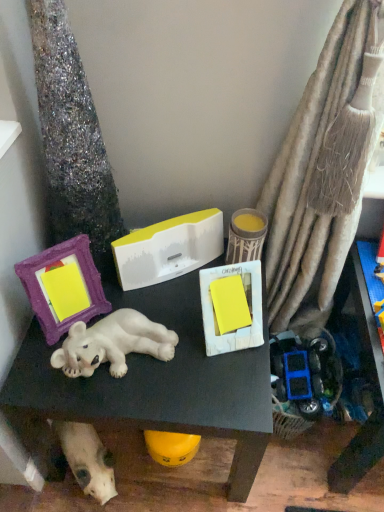
Identify the location of purple fabric picture frame at left. The width and height of the screenshot is (384, 512). (63, 286).

Identify the location of white matte dog at lower left. (87, 459).

What do you see at coordinates (153, 383) in the screenshot? I see `white glossy polar bear at center` at bounding box center [153, 383].

What do you see at coordinates (71, 135) in the screenshot? I see `sparkly silver tree trunk at left` at bounding box center [71, 135].

This screenshot has height=512, width=384. What do you see at coordinates (246, 236) in the screenshot? I see `matte yellow candle at center` at bounding box center [246, 236].

This screenshot has width=384, height=512. Find the location of `purple fabric picture frame at left`. purple fabric picture frame at left is located at coordinates (63, 286).

This screenshot has width=384, height=512. I want to click on toy on the right of white glossy polar bear at center, so click(x=246, y=236).

Which object is more forward, matte yellow candle at center or white glossy polar bear at center?

Positioned in front is white glossy polar bear at center.

Is matte yellow candle at center wider or thinner than white glossy polar bear at center?

matte yellow candle at center is thinner than white glossy polar bear at center.

From a real-world perspective, relative to sparkly silver tree trunk at left, is matte yellow candle at center vertically above or below?

matte yellow candle at center is below sparkly silver tree trunk at left.

Find the location of a particular element. This screenshot has width=384, height=512. toy below the sparkly silver tree trunk at left (from a real-world perspective) is located at coordinates (246, 236).

Would you say sparkly silver tree trunk at left is part of matte yellow candle at center's contents?

That's incorrect, sparkly silver tree trunk at left is not inside matte yellow candle at center.

Looking at this image, is sparkly silver tree trunk at left in front of or behind matte yellow candle at center in the image?

sparkly silver tree trunk at left is positioned closer to the viewer than matte yellow candle at center.

Is the surface of sparkly silver tree trunk at left in direct contact with matte yellow candle at center?

No, sparkly silver tree trunk at left is not next to matte yellow candle at center.

Is sparkly silver tree trunk at left smaller than matte yellow candle at center?

Actually, sparkly silver tree trunk at left might be larger than matte yellow candle at center.

You are a GUI agent. You are given a task and a screenshot of the screen. Output one action in this format:
    pyautogui.click(x=<x>, y=<y>)
    Task: Click on the toy below the sparkly silver tree trunk at left (from the image's perspective)
    
    Given the screenshot: What is the action you would take?
    pyautogui.click(x=246, y=236)

From the image's perspective, is white glossy polar bear at center above or below purple fabric picture frame at left?

Clearly, from the image's perspective, white glossy polar bear at center is below purple fabric picture frame at left.

Which point is more forward, (231, 478) or (59, 253)?

The point (59, 253) is closer.

Does white glossy polar bear at center lie in front of purple fabric picture frame at left?

No, it is not.

Find the location of a particular element. The width and height of the screenshot is (384, 512). table behind the purple fabric picture frame at left is located at coordinates (153, 383).

Looking at this image, does white matte dog at lower left turn towards matte yellow candle at center?

No, white matte dog at lower left is not turned towards matte yellow candle at center.

From a real-world perspective, which object stands above the other?

From a 3D spatial view, matte yellow candle at center is above.

Is white matte dog at lower left far away from matte yellow candle at center?

That's not correct — white matte dog at lower left is a little close to matte yellow candle at center.

Is white glossy polar bear at center facing towards white matte dog at lower left?

Yes.

Can we say white glossy polar bear at center lies outside white matte dog at lower left?

white glossy polar bear at center lies outside white matte dog at lower left's area.

How far apart are white glossy polar bear at center and white matte dog at lower left?

The distance of white glossy polar bear at center from white matte dog at lower left is 10.56 inches.

Between point (90, 410) and point (83, 438), which one is positioned behind?

The point (83, 438) is farther from the camera.

Is point (166, 384) behind point (49, 78)?

Yes, point (166, 384) is farther from viewer.

Is white glossy polar bear at center beside sparkly silver tree trunk at left?

No, white glossy polar bear at center is not touching sparkly silver tree trunk at left.

In terms of height, does white glossy polar bear at center look taller or shorter compared to sparkly silver tree trunk at left?

white glossy polar bear at center is shorter than sparkly silver tree trunk at left.

Considering the relative sizes of white glossy polar bear at center and sparkly silver tree trunk at left in the image provided, is white glossy polar bear at center bigger than sparkly silver tree trunk at left?

Yes.

Where is `toy located on the right of white glossy polar bear at center`? The width and height of the screenshot is (384, 512). toy located on the right of white glossy polar bear at center is located at coordinates (246, 236).

The height and width of the screenshot is (512, 384). I want to click on tree trunk that is above the matte yellow candle at center (from the image's perspective), so click(x=71, y=135).

Looking at the image, which one is located further to sparkly silver tree trunk at left, purple fabric picture frame at left or matte yellow candle at center?

matte yellow candle at center lies further to sparkly silver tree trunk at left than the other object.

Looking at the image, which one is located closer to matte yellow candle at center, purple fabric picture frame at left or white glossy polar bear at center?

white glossy polar bear at center lies closer to matte yellow candle at center than the other object.

When comparing their distances from white glossy polar bear at center, does white matte dog at lower left or matte yellow candle at center seem further?

Among the two, matte yellow candle at center is located further to white glossy polar bear at center.

Which object lies nearer to the anchor point matte yellow candle at center, white matte dog at lower left or purple fabric picture frame at left?

purple fabric picture frame at left is positioned closer to the anchor matte yellow candle at center.

Looking at the image, which one is located further to white glossy polar bear at center, matte yellow candle at center or sparkly silver tree trunk at left?

matte yellow candle at center is positioned further to the anchor white glossy polar bear at center.

Based on the photo, which object lies further to the anchor point white matte dog at lower left, white glossy polar bear at center or sparkly silver tree trunk at left?

Based on the image, sparkly silver tree trunk at left appears to be further to white matte dog at lower left.

Looking at the image, which one is located further to sparkly silver tree trunk at left, white glossy polar bear at center or purple fabric picture frame at left?

Based on the image, white glossy polar bear at center appears to be further to sparkly silver tree trunk at left.

Which object lies nearer to the anchor point white matte dog at lower left, sparkly silver tree trunk at left or purple fabric picture frame at left?

purple fabric picture frame at left is positioned closer to the anchor white matte dog at lower left.

Where is `picture frame that lies between sparkly silver tree trunk at left and white matte dog at lower left from top to bottom`? The width and height of the screenshot is (384, 512). picture frame that lies between sparkly silver tree trunk at left and white matte dog at lower left from top to bottom is located at coordinates (63, 286).

The height and width of the screenshot is (512, 384). Identify the location of picture frame between sparkly silver tree trunk at left and white glossy polar bear at center vertically. (63, 286).

Locate an element on the screen. The height and width of the screenshot is (512, 384). table between sparkly silver tree trunk at left and white matte dog at lower left vertically is located at coordinates (153, 383).

The height and width of the screenshot is (512, 384). Find the location of `tree trunk between purple fabric picture frame at left and matte yellow candle at center in the horizontal direction`. tree trunk between purple fabric picture frame at left and matte yellow candle at center in the horizontal direction is located at coordinates (71, 135).